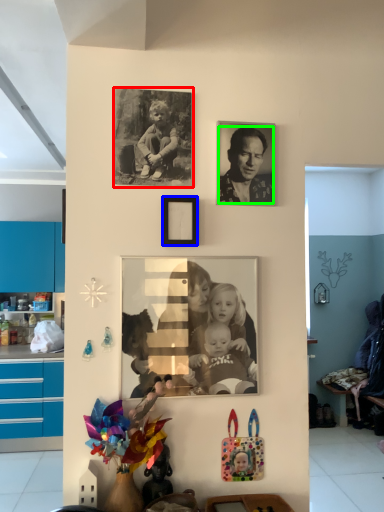
Question: Which object is positioned closest to picture frame (highlighted by a red box)? Select from picture frame (highlighted by a blue box) and person (highlighted by a green box).

Choices:
 (A) picture frame
 (B) person

Answer: (A)